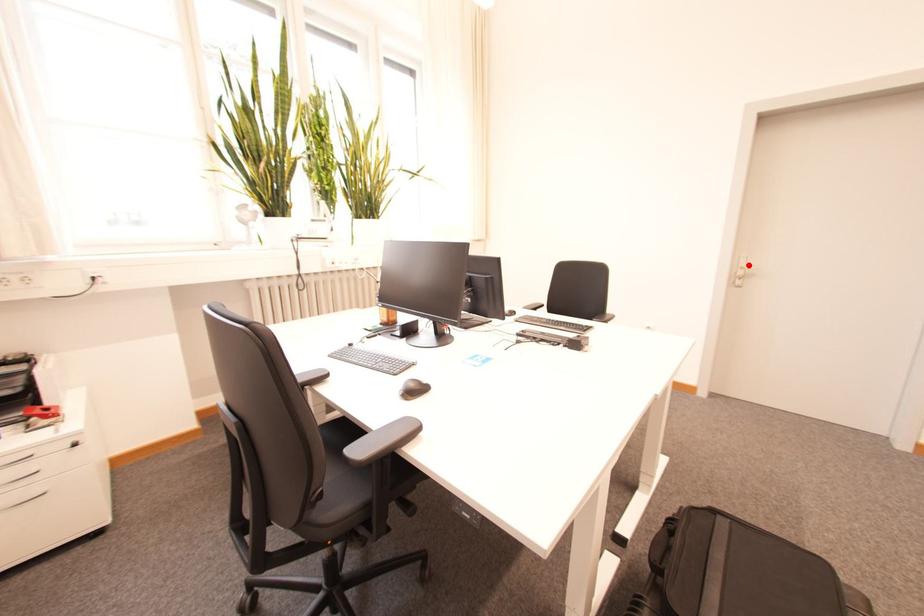
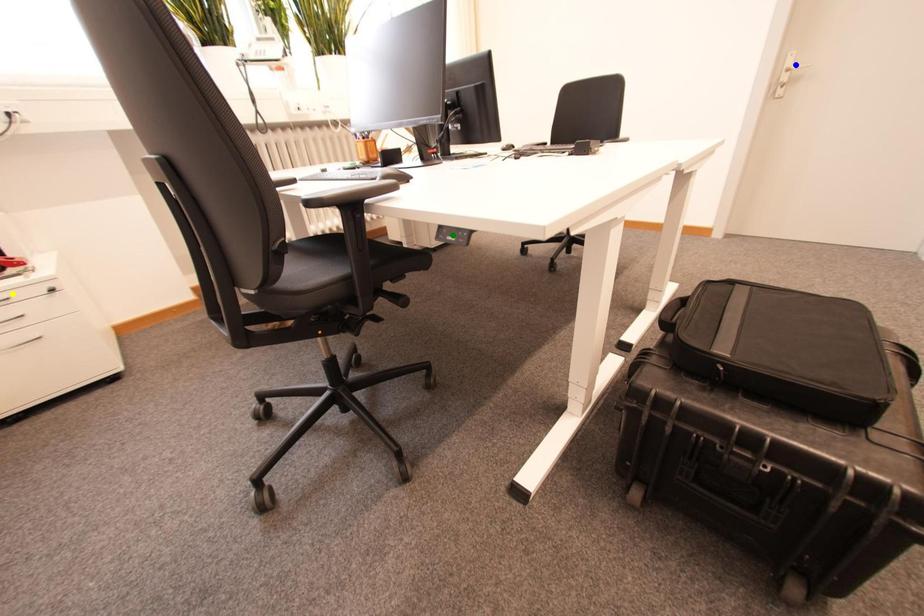
Question: I am providing you with two images of the same scene from different viewpoints. A red point is marked on the first image. You are given multiple points on the second image. Which spot in image 2 lines up with the point in image 1?

Choices:
 (A) blue point
 (B) green point
 (C) yellow point

Answer: (A)